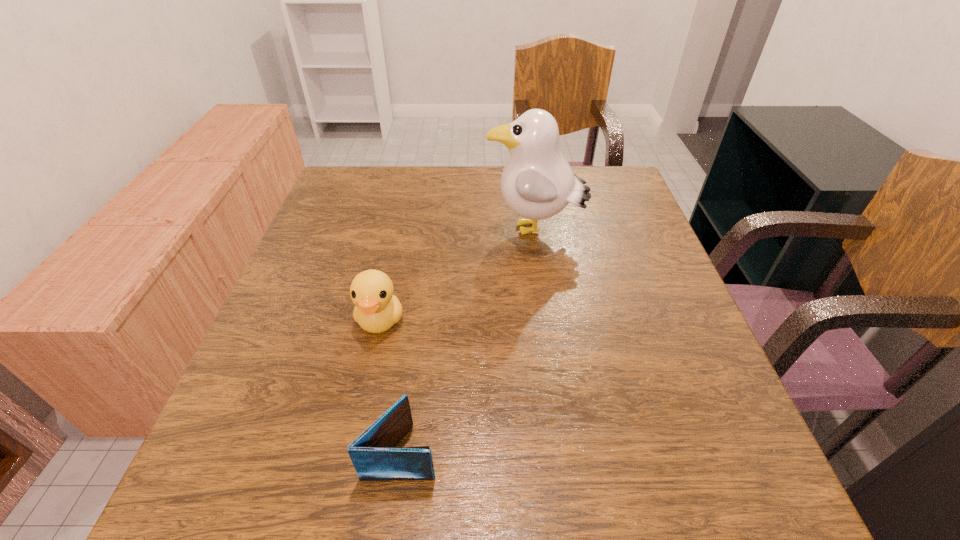
Locate an element on the screen. The image size is (960, 540). gull is located at coordinates (537, 182).

The image size is (960, 540). I want to click on the farthest object, so click(537, 182).

Where is `duck`? duck is located at coordinates (377, 309).

Where is `the second shortest object`? the second shortest object is located at coordinates (377, 309).

The width and height of the screenshot is (960, 540). Identify the location of the shortest object. (373, 455).

Where is `wallet`? The image size is (960, 540). wallet is located at coordinates (373, 455).

The image size is (960, 540). I want to click on vacant space located on the beak of the rightmost object, so click(x=402, y=231).

At what (x,y) coordinates should I click in order to perform the action: click on free space located on the beak of the rightmost object. Please return your answer as a coordinate pair (x, y). This screenshot has width=960, height=540. Looking at the image, I should click on (374, 231).

Identify the location of vacant space located on the beak of the rightmost object. (462, 231).

This screenshot has width=960, height=540. What are the coordinates of `blank area located 0.120m on the face of the duck` in the screenshot? It's located at coord(363,400).